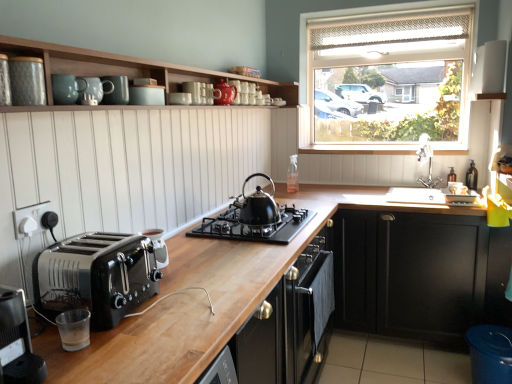
Question: Can you confirm if black matte cabinet at lower right, which ranks as the second cabinetry in top-to-bottom order, is thinner than matte ceramic mugs at upper center, which is the 2th cabinetry in right-to-left order?

Choices:
 (A) no
 (B) yes

Answer: (A)

Question: From the image's perspective, is black matte cabinet at lower right, which ranks as the second cabinetry in top-to-bottom order, beneath matte ceramic mugs at upper center, arranged as the 2th cabinetry when ordered from the bottom?

Choices:
 (A) yes
 (B) no

Answer: (A)

Question: Is black matte cabinet at lower right, which appears as the first cabinetry when viewed from the right, in front of matte ceramic mugs at upper center, positioned as the 1th cabinetry in left-to-right order?

Choices:
 (A) yes
 (B) no

Answer: (B)

Question: Can you confirm if black matte cabinet at lower right, which is the first cabinetry from bottom to top, is shorter than matte ceramic mugs at upper center, arranged as the 2th cabinetry when ordered from the bottom?

Choices:
 (A) yes
 (B) no

Answer: (B)

Question: Does black matte cabinet at lower right, which ranks as the second cabinetry in left-to-right order, appear on the right side of matte ceramic mugs at upper center, positioned as the 1th cabinetry in left-to-right order?

Choices:
 (A) no
 (B) yes

Answer: (B)

Question: From a real-world perspective, is matte ceramic canister at upper center, which is the fifth appliance from front to back, physically located above or below black matte kettle at center?

Choices:
 (A) above
 (B) below

Answer: (A)

Question: In the image, is matte ceramic canister at upper center, the fifth appliance from the right, positioned in front of or behind black matte kettle at center?

Choices:
 (A) front
 (B) behind

Answer: (A)

Question: Considering the positions of matte ceramic canister at upper center, which appears as the 4th appliance when viewed from the left, and black matte kettle at center in the image, is matte ceramic canister at upper center, which appears as the 4th appliance when viewed from the left, taller or shorter than black matte kettle at center?

Choices:
 (A) short
 (B) tall

Answer: (A)

Question: Do you think matte ceramic canister at upper center, the fifth appliance from the right, is within black matte kettle at center, or outside of it?

Choices:
 (A) outside
 (B) inside

Answer: (A)

Question: From a real-world perspective, is white textured roller blind at upper right positioned above or below matte ceramic mug at upper center, which ranks as the sixth appliance in back-to-front order?

Choices:
 (A) below
 (B) above

Answer: (B)

Question: Relative to matte ceramic mug at upper center, which is the third appliance from left to right, is white textured roller blind at upper right in front or behind?

Choices:
 (A) front
 (B) behind

Answer: (B)

Question: Is white textured roller blind at upper right to the left or to the right of matte ceramic mug at upper center, which is counted as the fifth appliance, starting from the top, in the image?

Choices:
 (A) right
 (B) left

Answer: (A)

Question: Based on their sizes in the image, would you say white textured roller blind at upper right is bigger or smaller than matte ceramic mug at upper center, which is the third appliance from left to right?

Choices:
 (A) small
 (B) big

Answer: (B)

Question: From their relative heights in the image, would you say matte ceramic canister at upper center, which appears as the 4th appliance when viewed from the left, is taller or shorter than glossy ceramic mugs at upper center, acting as the 2th appliance starting from the top?

Choices:
 (A) short
 (B) tall

Answer: (B)

Question: Is matte ceramic canister at upper center, the 5th appliance from the bottom, wider or thinner than glossy ceramic mugs at upper center, placed as the seventh appliance when sorted from front to back?

Choices:
 (A) thin
 (B) wide

Answer: (A)